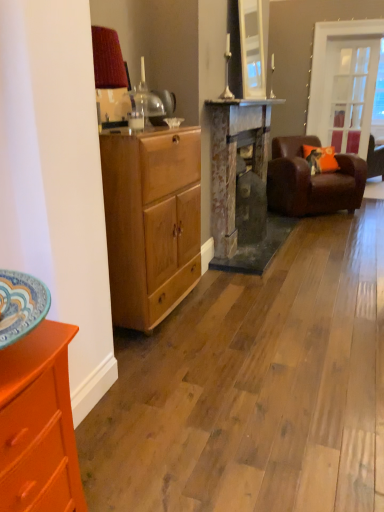
Question: Is rusty metal fireplace at center in front of or behind brown leather couch at right in the image?

Choices:
 (A) front
 (B) behind

Answer: (A)

Question: From a real-world perspective, relative to brown leather couch at right, is rusty metal fireplace at center vertically above or below?

Choices:
 (A) below
 (B) above

Answer: (B)

Question: Which is nearer to the rusty metal fireplace at center?

Choices:
 (A) orange wood dresser at lower left
 (B) clear glass door at upper right
 (C) orange fabric pillow at right
 (D) brown leather couch at right
 (E) light brown wood cabinet at left

Answer: (E)

Question: Which is nearer to the orange wood dresser at lower left?

Choices:
 (A) light brown wood cabinet at left
 (B) brown leather armchair at right
 (C) brown leather couch at right
 (D) clear glass door at upper right
 (E) rusty metal fireplace at center

Answer: (A)